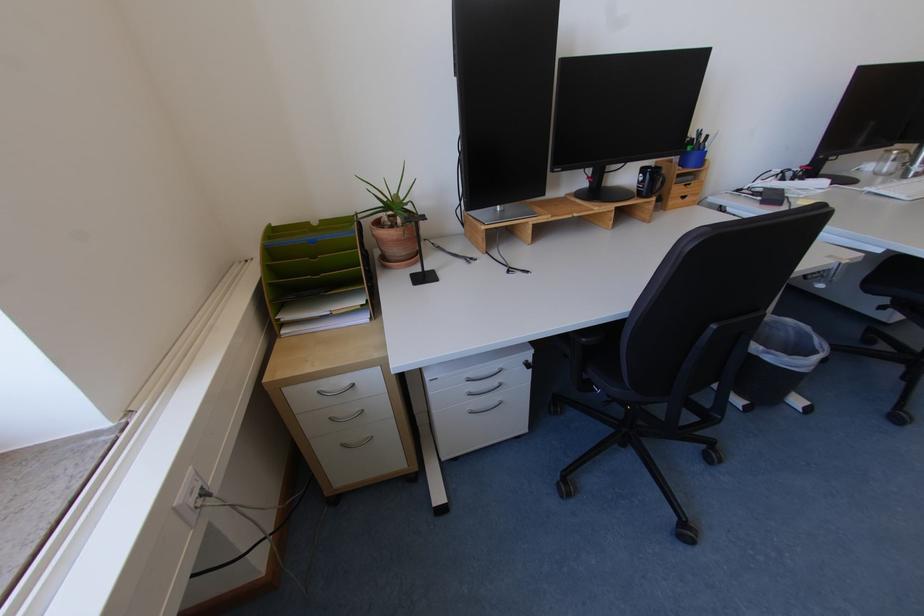
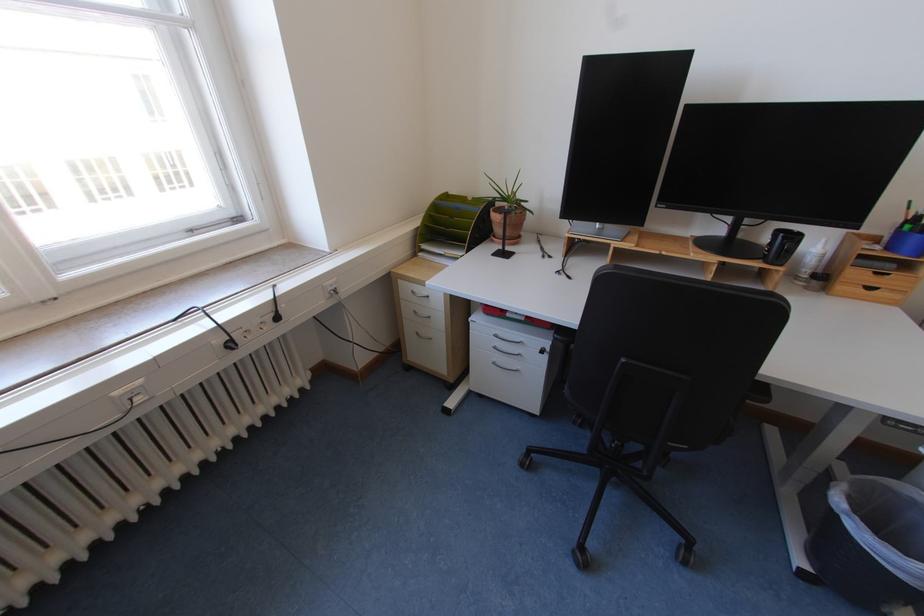
In the second image, find the point that corresponds to point 477,381 in the first image.

(504, 337)